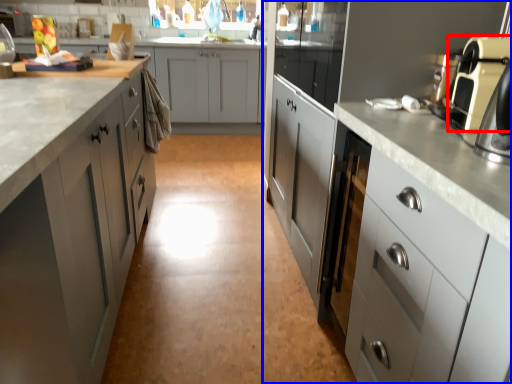
Question: Which point is further to the camera, home appliance (highlighted by a red box) or cabinetry (highlighted by a blue box)?

Choices:
 (A) home appliance
 (B) cabinetry

Answer: (B)